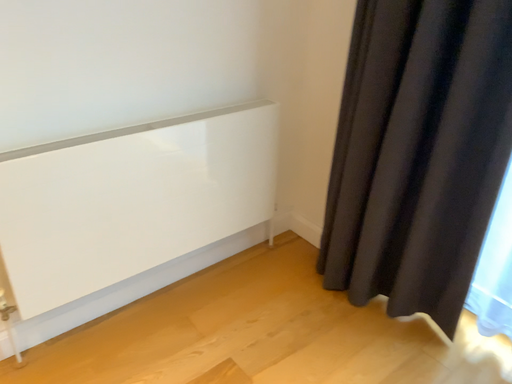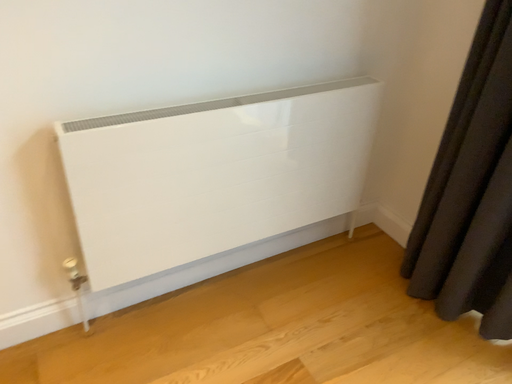
Question: How did the camera likely rotate when shooting the video?

Choices:
 (A) rotated left
 (B) rotated right

Answer: (A)